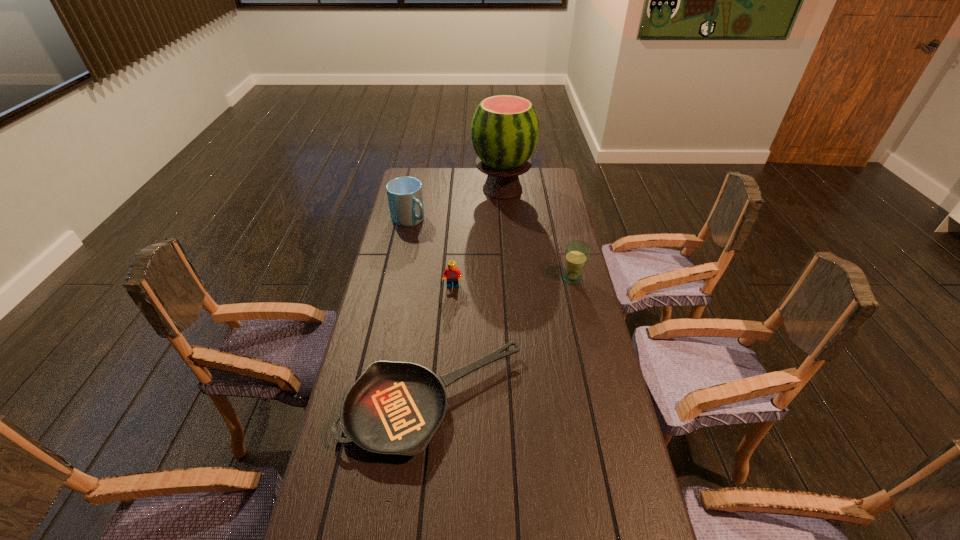
Where is `free spot at the far right corner of the desktop`? Image resolution: width=960 pixels, height=540 pixels. free spot at the far right corner of the desktop is located at coordinates (536, 172).

Where is `empty space between the fourth tallest object and the glass`? The image size is (960, 540). empty space between the fourth tallest object and the glass is located at coordinates (513, 282).

Find the location of a particular element. Image resolution: width=960 pixels, height=540 pixels. free space between the glass and the Lego is located at coordinates (513, 282).

The image size is (960, 540). I want to click on free spot between the second farthest object and the Lego, so click(x=431, y=253).

Image resolution: width=960 pixels, height=540 pixels. In order to click on free space between the fourth tallest object and the fourth nearest object in this screenshot , I will do `click(431, 253)`.

Locate an element on the screen. The height and width of the screenshot is (540, 960). free spot between the rightmost object and the Lego is located at coordinates (x=513, y=282).

Find the location of a particular element. This screenshot has height=540, width=960. free space between the fourth tallest object and the tallest object is located at coordinates (478, 238).

This screenshot has width=960, height=540. What are the coordinates of `vacant area that lies between the tallest object and the second shortest object` in the screenshot? It's located at (478, 238).

The image size is (960, 540). I want to click on empty space between the second farthest object and the watermelon, so click(456, 205).

Identify the location of vacant point located between the glass and the fourth tallest object. The width and height of the screenshot is (960, 540). (513, 282).